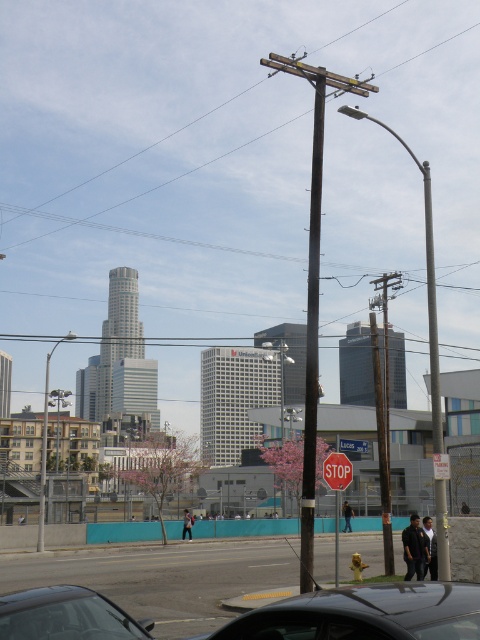
Which is more to the left, wooden pole at center or red matte stop sign at center?

wooden pole at center is more to the left.

Between wooden pole at center and red matte stop sign at center, which one appears on the right side from the viewer's perspective?

red matte stop sign at center is more to the right.

Identify the location of wooden pole at center. (149, 145).

You are a GUI agent. You are given a task and a screenshot of the screen. Output one action in this format:
    pyautogui.click(x=<x>, y=<y>)
    Task: Click on the wooden pole at center
    The width and height of the screenshot is (480, 640).
    Given the screenshot: What is the action you would take?
    pyautogui.click(x=149, y=145)

Between brown wooden telegraph pole at center and stop sign at center, which one appears on the right side from the viewer's perspective?

stop sign at center is more to the right.

Can you confirm if brown wooden telegraph pole at center is positioned to the left of stop sign at center?

Indeed, brown wooden telegraph pole at center is positioned on the left side of stop sign at center.

Describe the element at coordinates (312, 289) in the screenshot. I see `brown wooden telegraph pole at center` at that location.

At what (x,y) coordinates should I click in order to perform the action: click on brown wooden telegraph pole at center. Please return your answer as a coordinate pair (x, y). Image resolution: width=480 pixels, height=640 pixels. Looking at the image, I should click on (312, 289).

Does wooden pole at center have a greater width compared to stop sign at center?

Yes, wooden pole at center is wider than stop sign at center.

Describe the element at coordinates (149, 145) in the screenshot. I see `wooden pole at center` at that location.

Is point (243, 92) farther from viewer compared to point (350, 449)?

Yes, it is behind point (350, 449).

Find the location of a particular element. The image size is (480, 640). wooden pole at center is located at coordinates (149, 145).